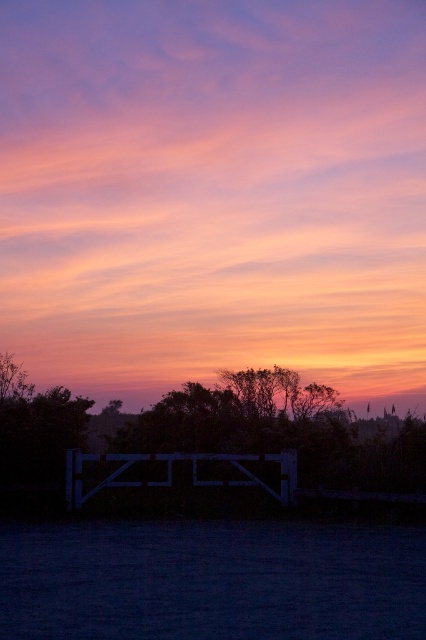
You are standing in the middle of the scene and want to walk towards the green leafy tree at center. In which direction should you move?

Since the green leafy tree at center is located at point (210, 442), you should move towards the right to reach it.

You are an artist planning to paint the sunset scene. You need to decide which object to paint first based on their sizes. According to the scene, which object should you paint first, the green leafy tree at center or the black matte fence at center?

The green leafy tree at center has a larger width than the black matte fence at center, so you should paint the green leafy tree at center first as it occupies more space in the scene.